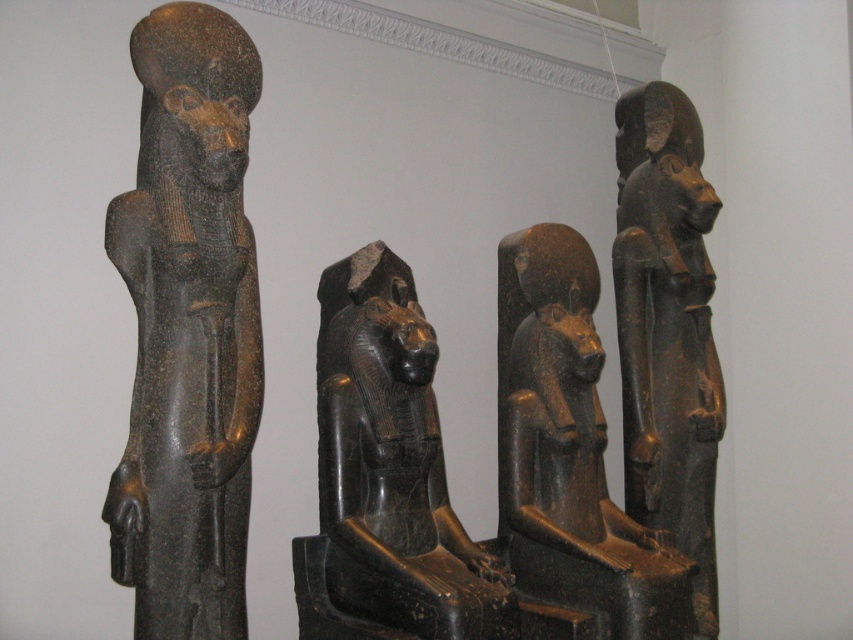
Is black stone statue at left smaller than black stone statue at right?

Yes.

Is black stone statue at left further to the viewer compared to black stone statue at right?

No, black stone statue at left is in front of black stone statue at right.

Is point (166, 632) less distant than point (703, 392)?

Yes, it is in front of point (703, 392).

The height and width of the screenshot is (640, 853). Find the location of `black stone statue at left`. black stone statue at left is located at coordinates (189, 328).

Does black stone statue at left have a greater width compared to black polished stone lion at center?

In fact, black stone statue at left might be narrower than black polished stone lion at center.

Is black stone statue at left to the left of black polished stone lion at center from the viewer's perspective?

Yes, black stone statue at left is to the left of black polished stone lion at center.

This screenshot has width=853, height=640. I want to click on black stone statue at left, so click(189, 328).

What are the coordinates of `black stone statue at left` in the screenshot? It's located at (189, 328).

Describe the element at coordinates (387, 474) in the screenshot. I see `black polished stone lion at center` at that location.

Does point (370, 337) lie in front of point (668, 337)?

Yes, point (370, 337) is closer to viewer.

Who is more forward, (x=343, y=305) or (x=647, y=435)?

Point (x=343, y=305)

The width and height of the screenshot is (853, 640). What are the coordinates of `black polished stone lion at center` in the screenshot? It's located at (387, 474).